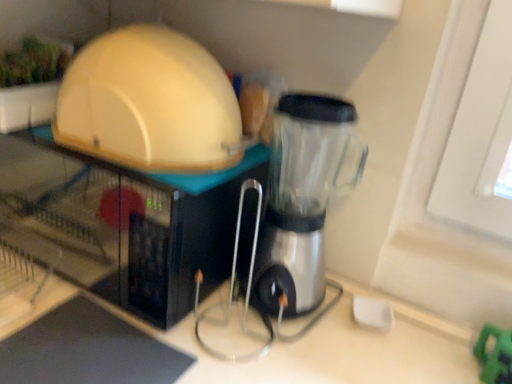
Question: Is transparent plastic blender at center bigger than matte white microwave at upper left, the 2th appliance from the top?

Choices:
 (A) yes
 (B) no

Answer: (B)

Question: Is transparent plastic blender at center smaller than matte white microwave at upper left, the first appliance from the bottom?

Choices:
 (A) no
 (B) yes

Answer: (B)

Question: Is there a large distance between transparent plastic blender at center and matte white microwave at upper left, the 2th appliance from the top?

Choices:
 (A) yes
 (B) no

Answer: (B)

Question: Is matte white microwave at upper left, the first appliance from the bottom, at the back of transparent plastic blender at center?

Choices:
 (A) yes
 (B) no

Answer: (B)

Question: From the image's perspective, is transparent plastic blender at center over matte white microwave at upper left, the first appliance from the bottom?

Choices:
 (A) no
 (B) yes

Answer: (A)

Question: Is transparent plastic blender at center to the right of matte white microwave at upper left, the 2th appliance from the top, from the viewer's perspective?

Choices:
 (A) no
 (B) yes

Answer: (B)

Question: From the image's perspective, does matte white dome at upper left, acting as the second appliance starting from the bottom, appear higher than matte white microwave at upper left, the first appliance from the bottom?

Choices:
 (A) yes
 (B) no

Answer: (A)

Question: From a real-world perspective, is matte white dome at upper left, acting as the first appliance starting from the top, physically above matte white microwave at upper left, the 2th appliance from the top?

Choices:
 (A) yes
 (B) no

Answer: (A)

Question: Is matte white dome at upper left, acting as the first appliance starting from the top, thinner than matte white microwave at upper left, the 2th appliance from the top?

Choices:
 (A) yes
 (B) no

Answer: (A)

Question: Is the position of matte white dome at upper left, acting as the second appliance starting from the bottom, less distant than that of matte white microwave at upper left, the first appliance from the bottom?

Choices:
 (A) no
 (B) yes

Answer: (B)

Question: From the image's perspective, is matte white dome at upper left, acting as the second appliance starting from the bottom, below matte white microwave at upper left, the first appliance from the bottom?

Choices:
 (A) yes
 (B) no

Answer: (B)

Question: Considering the relative sizes of matte white dome at upper left, acting as the second appliance starting from the bottom, and matte white microwave at upper left, the first appliance from the bottom, in the image provided, is matte white dome at upper left, acting as the second appliance starting from the bottom, smaller than matte white microwave at upper left, the first appliance from the bottom,?

Choices:
 (A) no
 (B) yes

Answer: (B)

Question: Does transparent plastic blender at center appear on the left side of matte white dome at upper left, acting as the second appliance starting from the bottom?

Choices:
 (A) yes
 (B) no

Answer: (B)